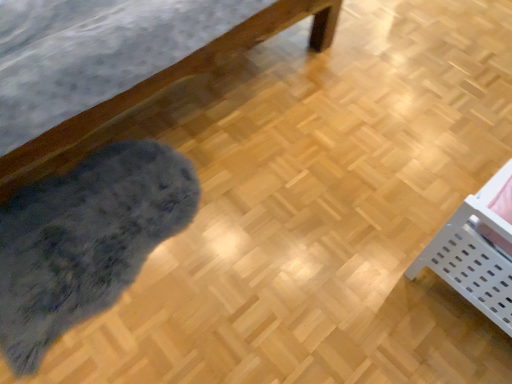
The image size is (512, 384). Find the location of `blank space above fuzzy gray mat at lower left (from a real-world perspective)`. blank space above fuzzy gray mat at lower left (from a real-world perspective) is located at coordinates (48, 244).